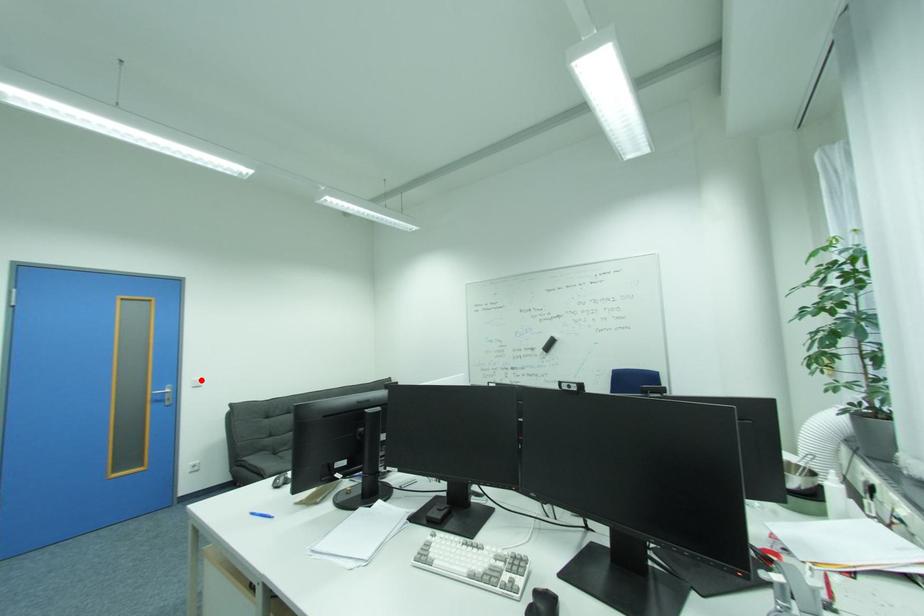
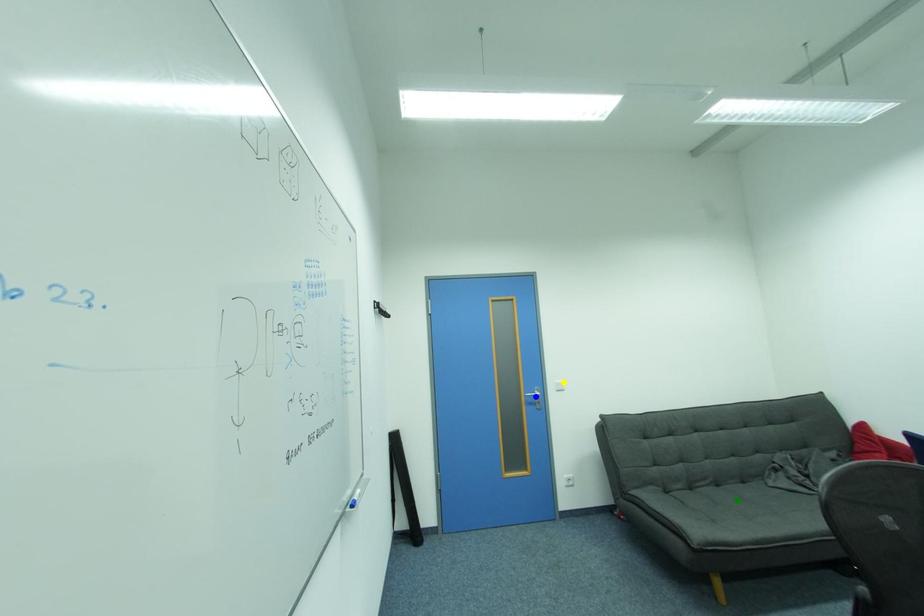
Question: I am providing you with two images of the same scene from different viewpoints. A red point is marked on the first image. You are given multiple points on the second image. Which point in image 2 represents the same 3d spot as the red point in image 1?

Choices:
 (A) blue point
 (B) green point
 (C) yellow point

Answer: (C)